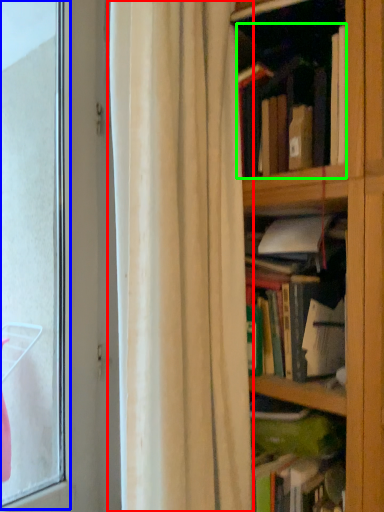
Question: Which is nearer to the curtain (highlighted by a red box)? bay window (highlighted by a blue box) or book (highlighted by a green box).

Choices:
 (A) bay window
 (B) book

Answer: (B)